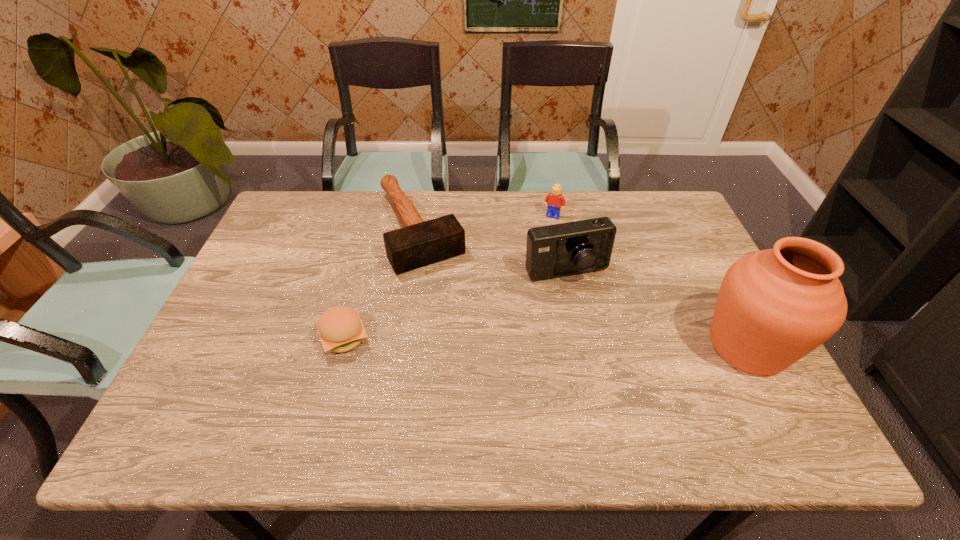
At what (x,y) coordinates should I click in order to perform the action: click on object situated at the right edge. Please return your answer as a coordinate pair (x, y). Image resolution: width=960 pixels, height=540 pixels. Looking at the image, I should click on (775, 306).

Where is `object at the near right corner`? object at the near right corner is located at coordinates (775, 306).

Where is `vacant space at the far edge of the desktop`? This screenshot has width=960, height=540. vacant space at the far edge of the desktop is located at coordinates (495, 203).

At what (x,y) coordinates should I click in order to perform the action: click on blank space at the near edge of the desktop. Please return your answer as a coordinate pair (x, y). Looking at the image, I should click on (318, 379).

This screenshot has height=540, width=960. In the image, there is a desktop. Identify the location of vacant space at the left edge. (263, 284).

Image resolution: width=960 pixels, height=540 pixels. In order to click on free spot at the right edge of the desktop in this screenshot , I will do `click(718, 359)`.

In the image, there is a desktop. Where is `vacant space at the far left corner`? The width and height of the screenshot is (960, 540). vacant space at the far left corner is located at coordinates (281, 236).

In the image, there is a desktop. Identify the location of free space at the far right corner. (652, 228).

Find the location of a particular element. free space that is in between the tallest object and the third tallest object is located at coordinates (650, 281).

Locate an element on the screen. This screenshot has width=960, height=540. vacant area that lies between the camera and the hamburger is located at coordinates (455, 305).